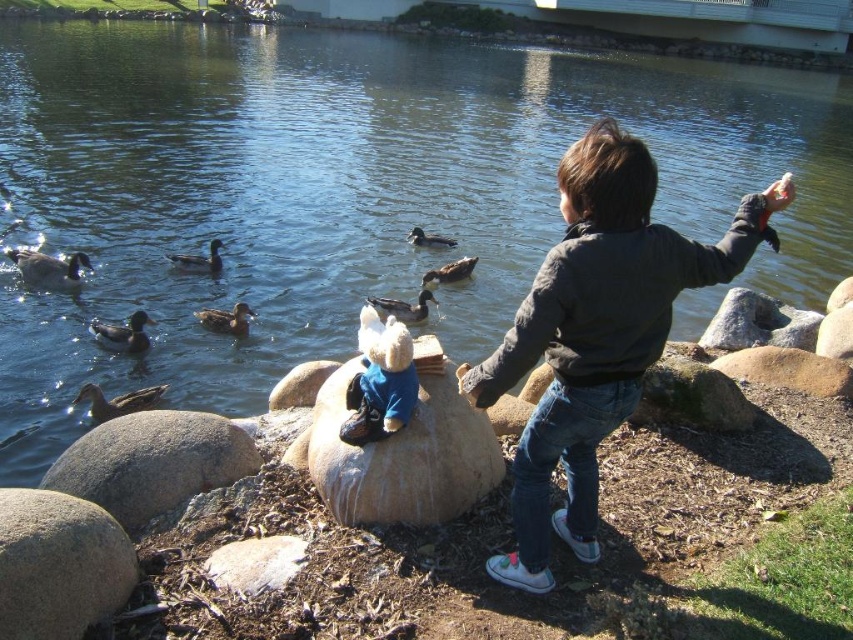
Can you confirm if brown rough rock at center is wider than brown rough stone at center?

Indeed, brown rough rock at center has a greater width compared to brown rough stone at center.

Between point (827, 380) and point (291, 378), which one is positioned in front?

Positioned in front is point (827, 380).

Who is more forward, (840, 388) or (276, 396)?

Point (840, 388) is more forward.

Find the location of a particular element. brown rough rock at center is located at coordinates (788, 369).

Can you confirm if smooth gray rock at lower left is positioned below brown matte duck at center-left?

Yes.

Who is more forward, (x=61, y=554) or (x=209, y=323)?

Point (x=61, y=554) is more forward.

This screenshot has width=853, height=640. I want to click on smooth gray rock at lower left, so click(x=59, y=564).

Between point (6, 608) and point (773, 320), which one is positioned in front?

Positioned in front is point (6, 608).

Can you confirm if smooth gray rock at lower left is positioned above gray rock at center?

No.

Between point (56, 564) and point (752, 310), which one is positioned behind?

The point (752, 310) is more distant.

Find the location of `smooth gray rock at lower left`. smooth gray rock at lower left is located at coordinates (59, 564).